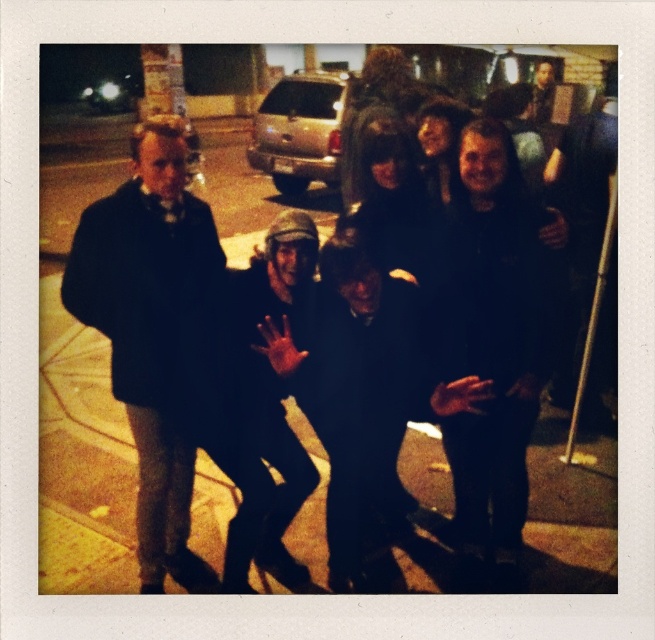
You are a photographer trying to capture a group photo of the five people in the scene. You want to ensure that both the black fuzzy jacket at center and the dark gray knit hat at center are clearly visible in the photo. Considering their sizes, which object might require you to adjust your camera angle to ensure it doesn not get obscured by the other?

The black fuzzy jacket at center is bigger than the dark gray knit hat at center. Therefore, the dark gray knit hat at center might be more likely to be obscured by the larger jacket, so adjusting the camera angle to focus on the hat could be necessary.

You are a fashion designer observing the group of people in the image. You notice the dark brown leather jacket at center and the dark gray knit hat at center. Which clothing item is positioned lower on the person?

The dark brown leather jacket at center is below dark gray knit hat at center, so the dark brown leather jacket at center is positioned lower.